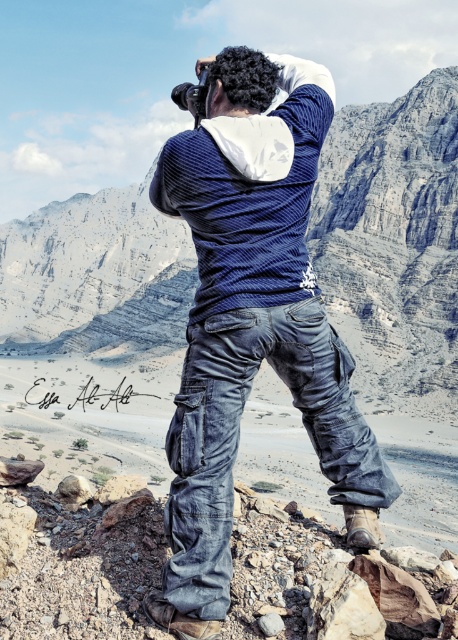
You are a photographer trying to capture the perfect shot of the rocky outcrop. You have a camera and want to place a small marker at point (178, 413). If your camera can focus on objects up to 30 meters away, will the marker be in focus when placed at that point?

The point (178, 413) is 32.18 meters from the camera. Since the camera can only focus up to 30 meters, the marker placed there will be out of focus.

You are a photographer trying to position two markers for a landscape shot. You have two markers at point coordinates point (383, 484) and point (410, 184). Which marker is closer to the camera?

Result: Point (383, 484) is in front of point (410, 184), so the marker at point (383, 484) is closer to the camera.